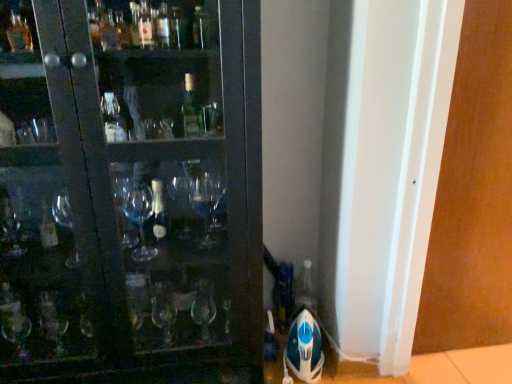
Question: From a real-world perspective, relative to white glossy screen door at right, marked as the first screen door in a left-to-right arrangement, is brown matte screen door at right, arranged as the 1th screen door when viewed from the right, vertically above or below?

Choices:
 (A) below
 (B) above

Answer: (B)

Question: From their relative heights in the image, would you say brown matte screen door at right, arranged as the second screen door when viewed from the left, is taller or shorter than white glossy screen door at right, positioned as the 2th screen door in right-to-left order?

Choices:
 (A) tall
 (B) short

Answer: (A)

Question: Is brown matte screen door at right, arranged as the second screen door when viewed from the left, inside the boundaries of white glossy screen door at right, positioned as the 2th screen door in right-to-left order, or outside?

Choices:
 (A) outside
 (B) inside

Answer: (A)

Question: In terms of size, does white glossy screen door at right, positioned as the 2th screen door in right-to-left order, appear bigger or smaller than brown matte screen door at right, arranged as the second screen door when viewed from the left?

Choices:
 (A) big
 (B) small

Answer: (A)

Question: Is white glossy screen door at right, positioned as the 2th screen door in right-to-left order, to the left or to the right of brown matte screen door at right, arranged as the 1th screen door when viewed from the right, in the image?

Choices:
 (A) left
 (B) right

Answer: (A)

Question: From a real-world perspective, relative to brown matte screen door at right, arranged as the second screen door when viewed from the left, is white glossy screen door at right, marked as the first screen door in a left-to-right arrangement, vertically above or below?

Choices:
 (A) below
 (B) above

Answer: (A)

Question: From the image's perspective, relative to brown matte screen door at right, arranged as the second screen door when viewed from the left, is white glossy screen door at right, positioned as the 2th screen door in right-to-left order, above or below?

Choices:
 (A) above
 (B) below

Answer: (B)